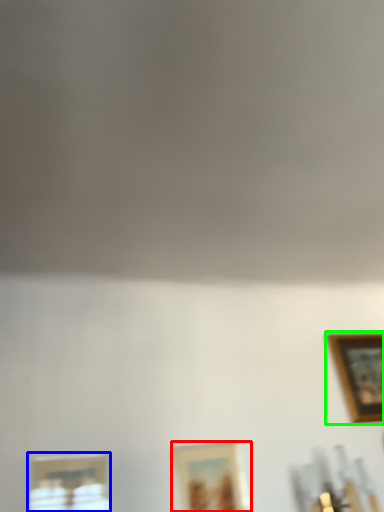
Question: Which object is positioned closest to picture frame (highlighted by a red box)? Select from picture frame (highlighted by a blue box) and picture frame (highlighted by a green box).

Choices:
 (A) picture frame
 (B) picture frame

Answer: (A)